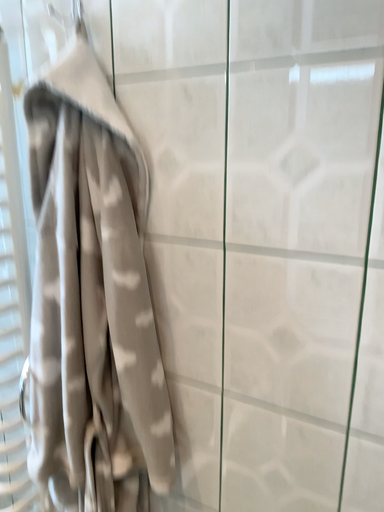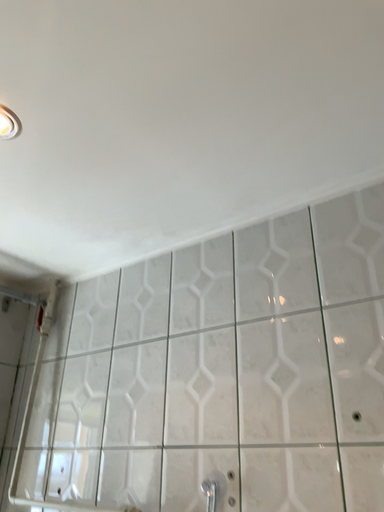
Question: Which way did the camera rotate in the video?

Choices:
 (A) rotated right
 (B) rotated left

Answer: (B)